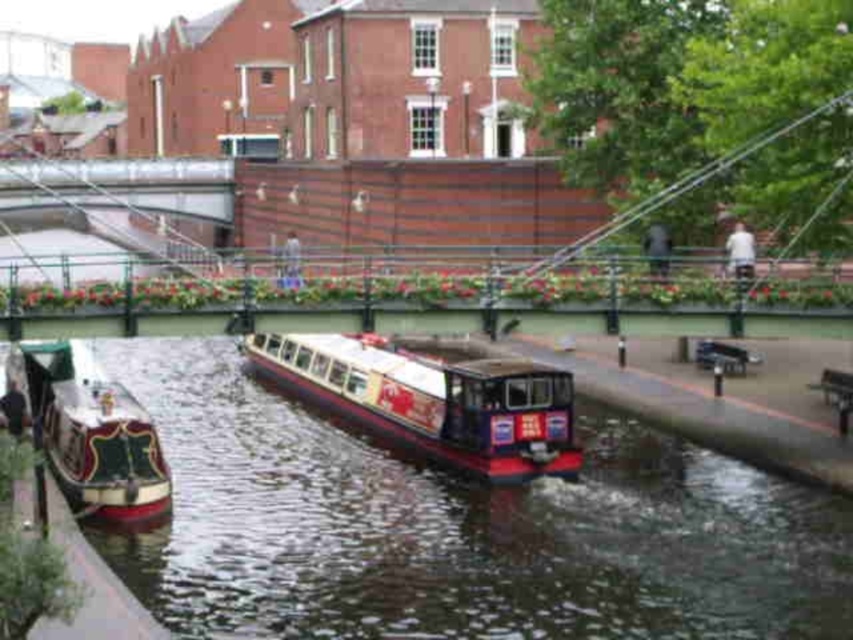
Is shiny metallic boat at center to the left of polished wood boat at lower left from the viewer's perspective?

No, shiny metallic boat at center is not to the left of polished wood boat at lower left.

Is shiny metallic boat at center thinner than polished wood boat at lower left?

No.

Who is more forward, (331, 385) or (142, 467)?

Point (142, 467)

Locate an element on the screen. The height and width of the screenshot is (640, 853). shiny metallic boat at center is located at coordinates (431, 401).

Where is `smooth dark water at center`? Image resolution: width=853 pixels, height=640 pixels. smooth dark water at center is located at coordinates (459, 529).

Is smooth dark water at center above shiny metallic boat at center?

Indeed, smooth dark water at center is positioned over shiny metallic boat at center.

Does point (248, 442) lie behind point (566, 372)?

Yes, point (248, 442) is farther from viewer.

Is point (271, 461) less distant than point (279, 349)?

Yes, point (271, 461) is in front of point (279, 349).

Where is `smooth dark water at center`? Image resolution: width=853 pixels, height=640 pixels. smooth dark water at center is located at coordinates (459, 529).